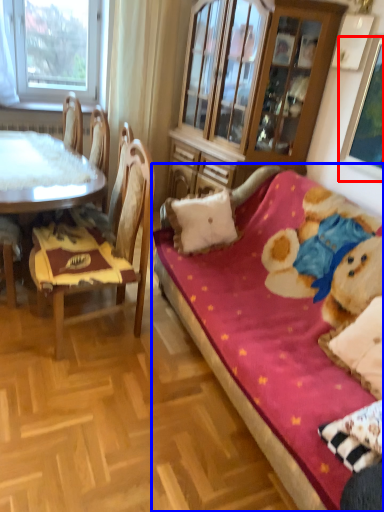
Question: Among these objects, which one is nearest to the camera, picture frame (highlighted by a red box) or studio couch (highlighted by a blue box)?

Choices:
 (A) picture frame
 (B) studio couch

Answer: (B)